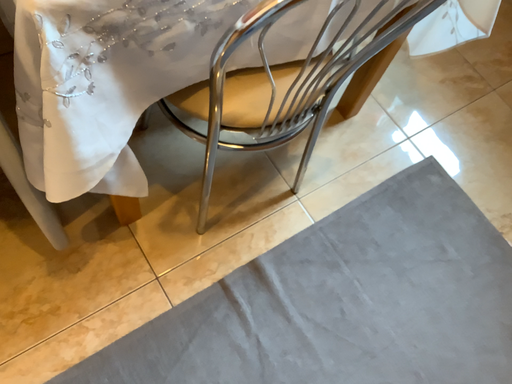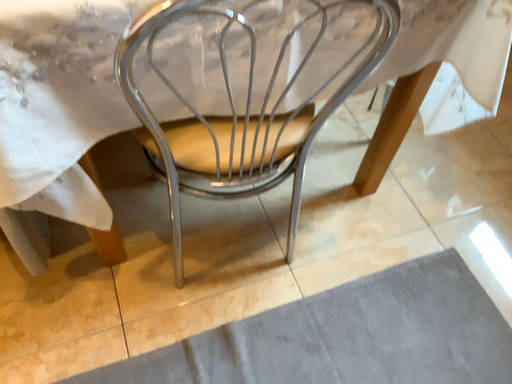
Question: Which way did the camera rotate in the video?

Choices:
 (A) rotated downward
 (B) rotated upward

Answer: (B)